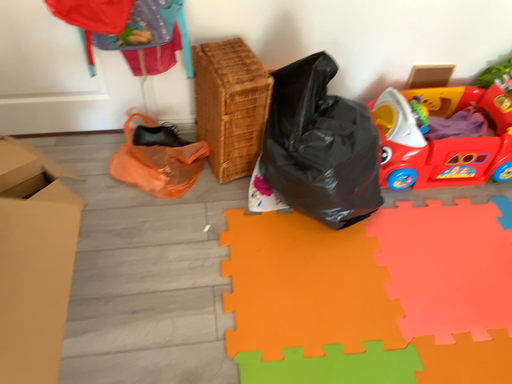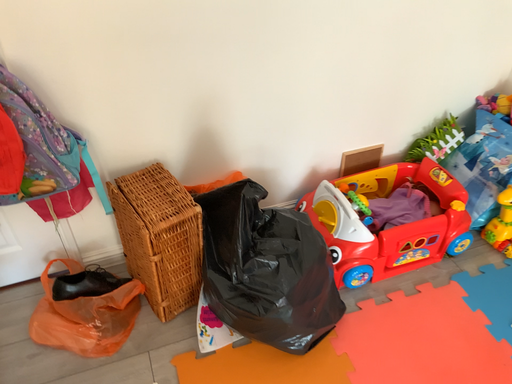
Question: How did the camera likely rotate when shooting the video?

Choices:
 (A) rotated downward
 (B) rotated upward

Answer: (B)